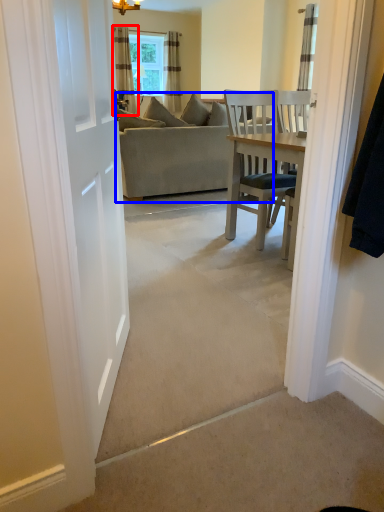
Question: Which point is closer to the camera, curtain (highlighted by a red box) or studio couch (highlighted by a blue box)?

Choices:
 (A) curtain
 (B) studio couch

Answer: (B)